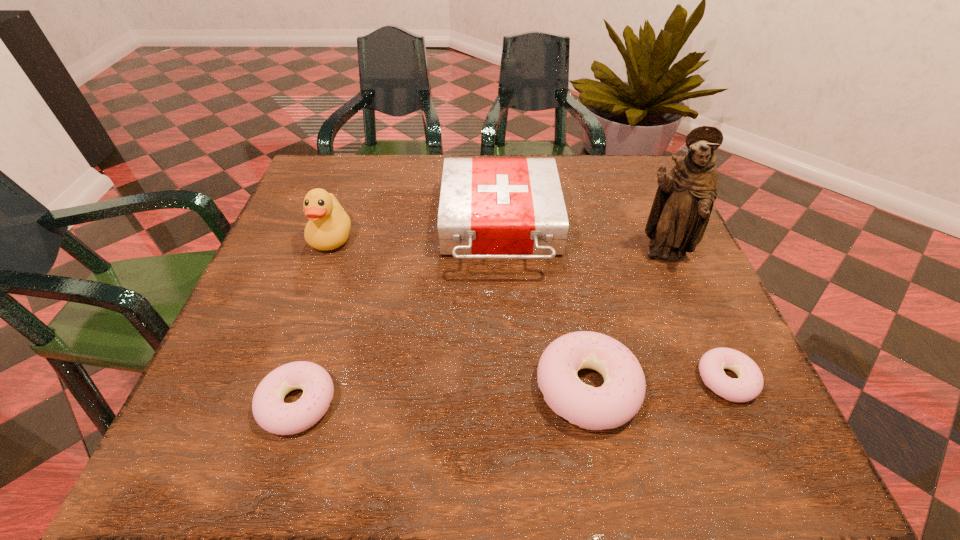
At what (x,y) coordinates should I click in order to perform the action: click on free space located 0.350m on the left of the third shortest object. Please return your answer as a coordinate pair (x, y). The image size is (960, 540). Looking at the image, I should click on (329, 387).

Find the location of a particular element. Image resolution: width=960 pixels, height=540 pixels. free region located on the back of the shortest object is located at coordinates (683, 279).

At what (x,y) coordinates should I click in order to perform the action: click on vacant space located 0.150m at the beak of the duck. Please return your answer as a coordinate pair (x, y). The width and height of the screenshot is (960, 540). Looking at the image, I should click on (306, 309).

This screenshot has height=540, width=960. In order to click on vacant space located 0.200m on the front side of the fourth shortest object in this screenshot , I will do `click(507, 363)`.

You are a GUI agent. You are given a task and a screenshot of the screen. Output one action in this format:
    pyautogui.click(x=<x>, y=<y>)
    Task: Click on the free space located 0.120m on the front-facing side of the figurine
    This screenshot has width=960, height=540.
    Given the screenshot: What is the action you would take?
    pyautogui.click(x=690, y=318)

You are a GUI agent. You are given a task and a screenshot of the screen. Output one action in this format:
    pyautogui.click(x=<x>, y=<y>)
    Task: Click on the object situated at the far edge
    
    Given the screenshot: What is the action you would take?
    click(x=490, y=208)

Where is `doughnut present at the left edge`? Image resolution: width=960 pixels, height=540 pixels. doughnut present at the left edge is located at coordinates (x=269, y=410).

Find the location of `duck that is at the left edge`. duck that is at the left edge is located at coordinates (328, 228).

Where is `doughnut present at the right edge`? doughnut present at the right edge is located at coordinates (748, 386).

Where is `figurine present at the right edge`? The image size is (960, 540). figurine present at the right edge is located at coordinates (680, 213).